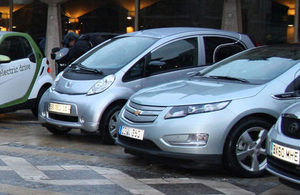
I want to click on tiled floor, so click(73, 175).